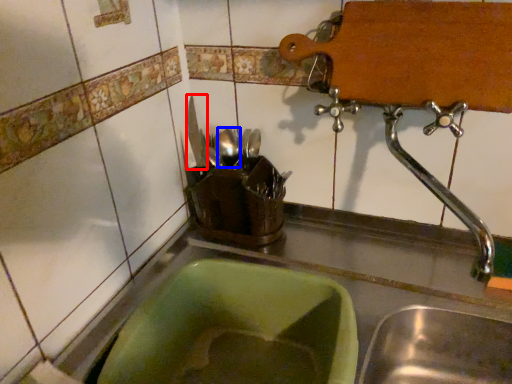
Question: Which point is further to the camera, tableware (highlighted by a red box) or tableware (highlighted by a blue box)?

Choices:
 (A) tableware
 (B) tableware

Answer: (A)